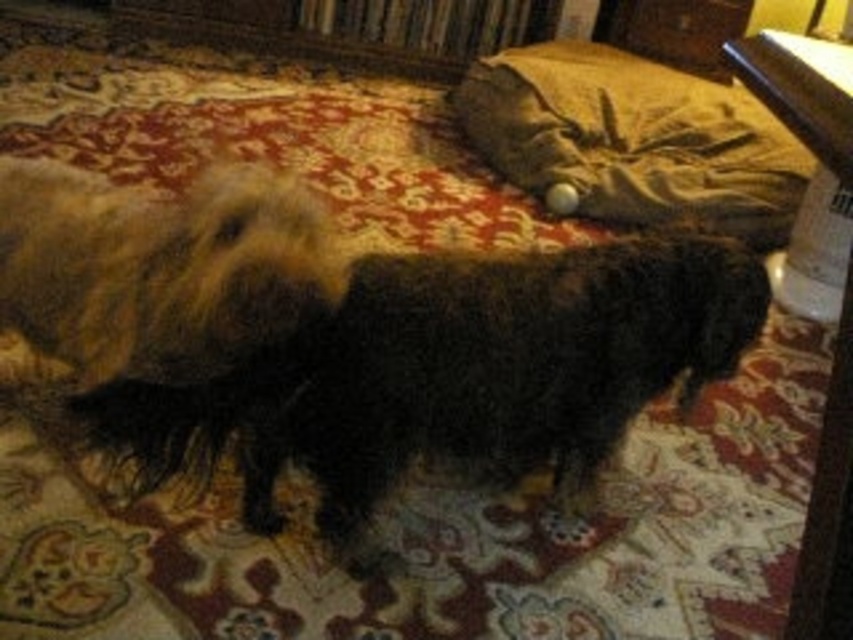
Question: Does fuzzy black dog at center appear on the left side of velvet-like brown dog bed at upper right?

Choices:
 (A) no
 (B) yes

Answer: (B)

Question: Which point is farther to the camera?

Choices:
 (A) (194, 420)
 (B) (633, 145)

Answer: (B)

Question: Can you confirm if fuzzy black dog at center is positioned to the right of velvet-like brown dog bed at upper right?

Choices:
 (A) no
 (B) yes

Answer: (A)

Question: Among these points, which one is farthest from the camera?

Choices:
 (A) (318, 390)
 (B) (637, 97)

Answer: (B)

Question: Which point is farther to the camera?

Choices:
 (A) (746, 204)
 (B) (337, 467)

Answer: (A)

Question: Is fuzzy black dog at center bigger than velvet-like brown dog bed at upper right?

Choices:
 (A) yes
 (B) no

Answer: (B)